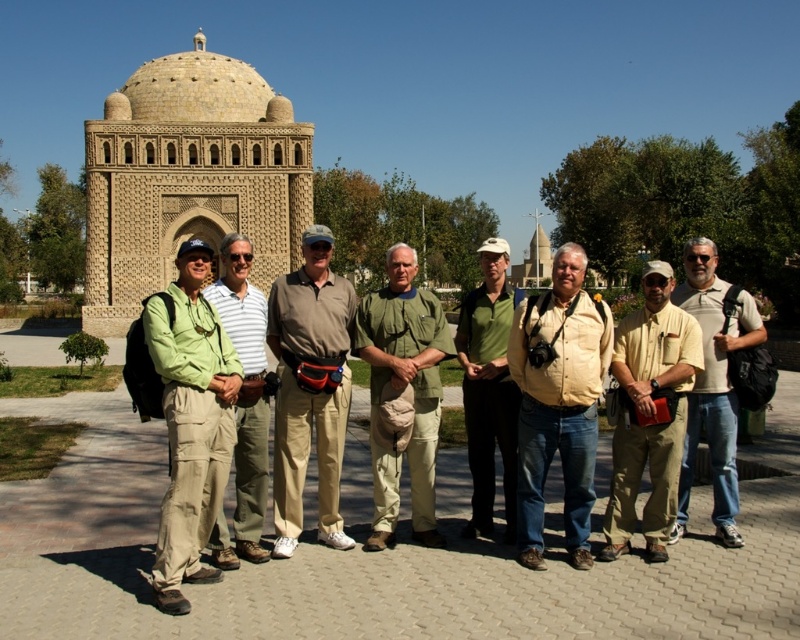
Does green fabric shirt at center appear on the left side of green canvas shirt at center?

No, green fabric shirt at center is not to the left of green canvas shirt at center.

Image resolution: width=800 pixels, height=640 pixels. In order to click on green fabric shirt at center in this screenshot , I will do `click(401, 392)`.

Consider the image. Is the position of yellow matte shirt at center less distant than that of light brown denim jeans at center?

Yes.

Is yellow matte shirt at center thinner than light brown denim jeans at center?

Correct, yellow matte shirt at center's width is less than light brown denim jeans at center's.

Is point (594, 385) behind point (726, 289)?

No.

The width and height of the screenshot is (800, 640). In order to click on yellow matte shirt at center in this screenshot , I will do `click(558, 403)`.

The image size is (800, 640). What do you see at coordinates (713, 384) in the screenshot?
I see `light brown denim jeans at center` at bounding box center [713, 384].

Can you confirm if light brown denim jeans at center is taller than green matte shirt at center?

Indeed, light brown denim jeans at center has a greater height compared to green matte shirt at center.

Locate an element on the screen. light brown denim jeans at center is located at coordinates (713, 384).